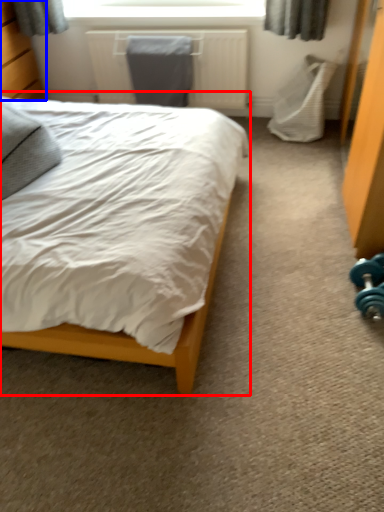
Question: Which of the following is the closest to the observer, bed (highlighted by a red box) or dresser (highlighted by a blue box)?

Choices:
 (A) bed
 (B) dresser

Answer: (A)